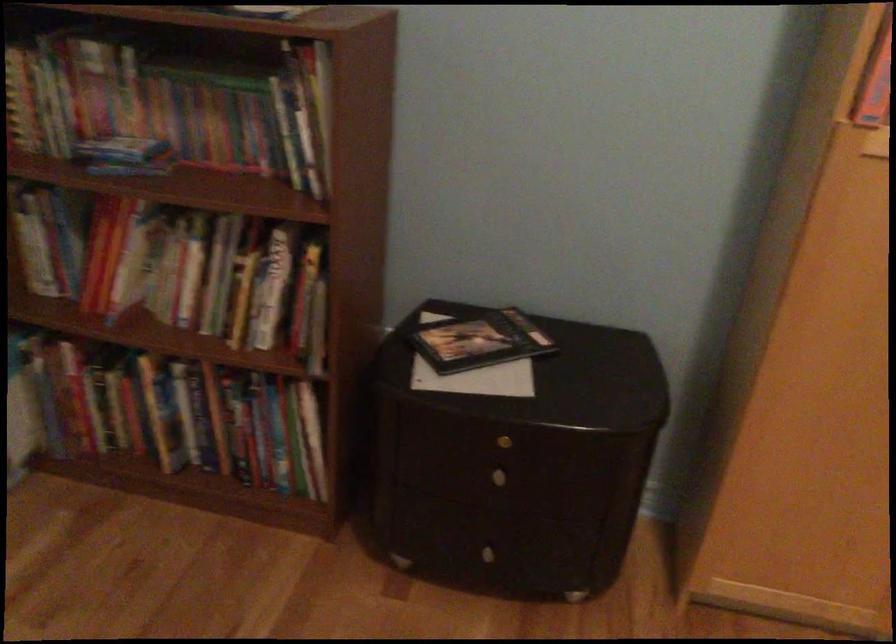
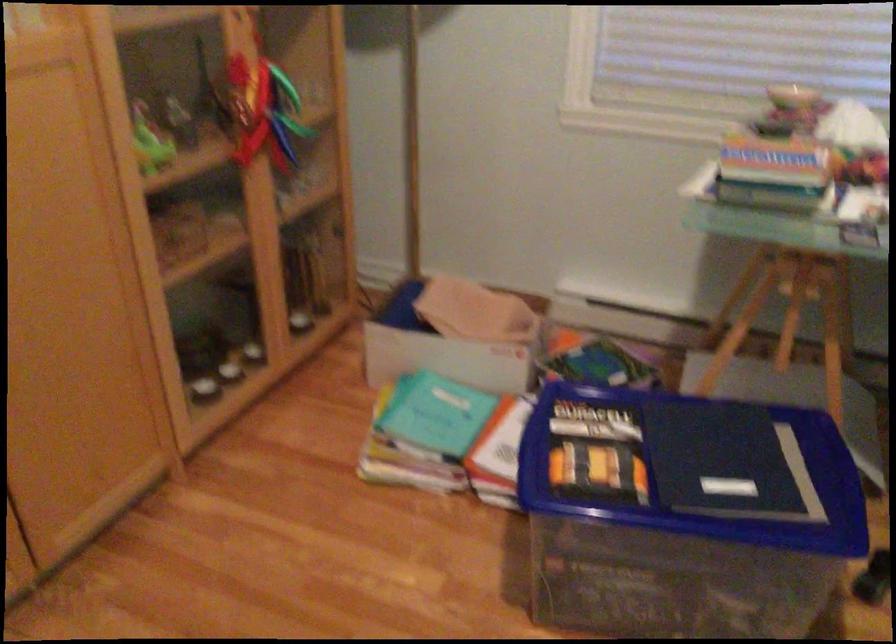
Based on the continuous images, in which direction is the camera rotating?

The rotation direction of the camera is right-down.